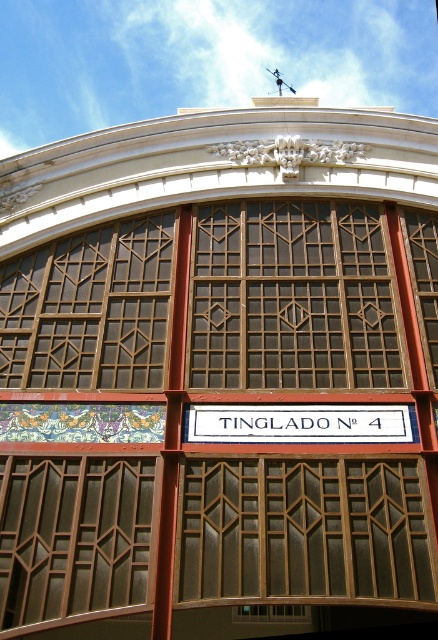
Who is positioned more to the left, brown textured glass at center or white painted wood sign at center?

From the viewer's perspective, brown textured glass at center appears more on the left side.

Can you confirm if brown textured glass at center is positioned to the right of white painted wood sign at center?

In fact, brown textured glass at center is to the left of white painted wood sign at center.

This screenshot has width=438, height=640. What are the coordinates of `brown textured glass at center` in the screenshot? It's located at (304, 531).

Is point (230, 480) positioned after point (60, 536)?

Yes, point (230, 480) is behind point (60, 536).

Can you confirm if brown textured glass at center is smaller than brown wooden window at left?

Actually, brown textured glass at center might be larger than brown wooden window at left.

Between point (338, 595) and point (137, 564), which one is positioned in front?

Point (338, 595) is in front.

Where is `brown textured glass at center`? The width and height of the screenshot is (438, 640). brown textured glass at center is located at coordinates (304, 531).

Is brown wooden window at left positioned behind white painted wood sign at center?

No, brown wooden window at left is in front of white painted wood sign at center.

Is point (56, 458) farther from camera compared to point (250, 422)?

No, (56, 458) is closer to viewer.

Locate an element on the screen. brown wooden window at left is located at coordinates (73, 536).